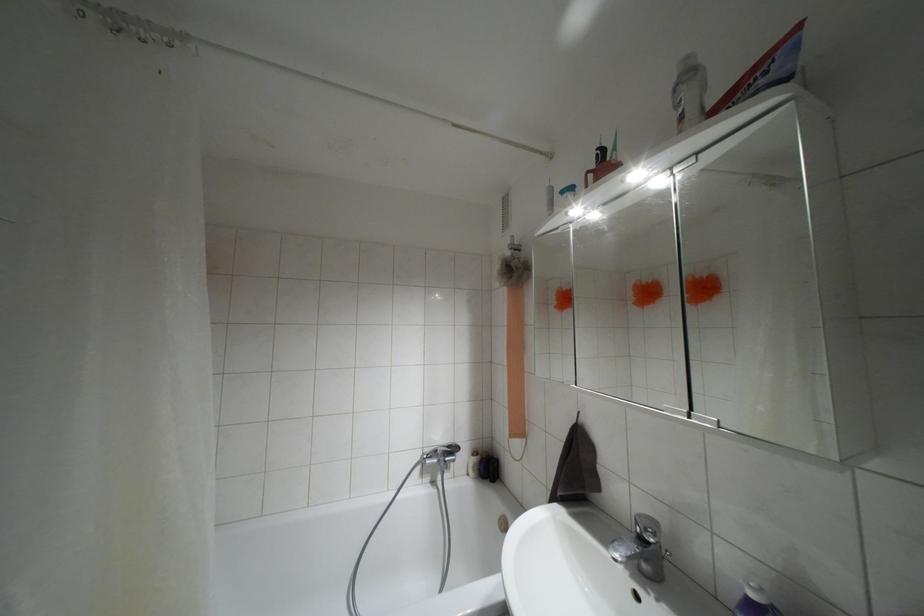
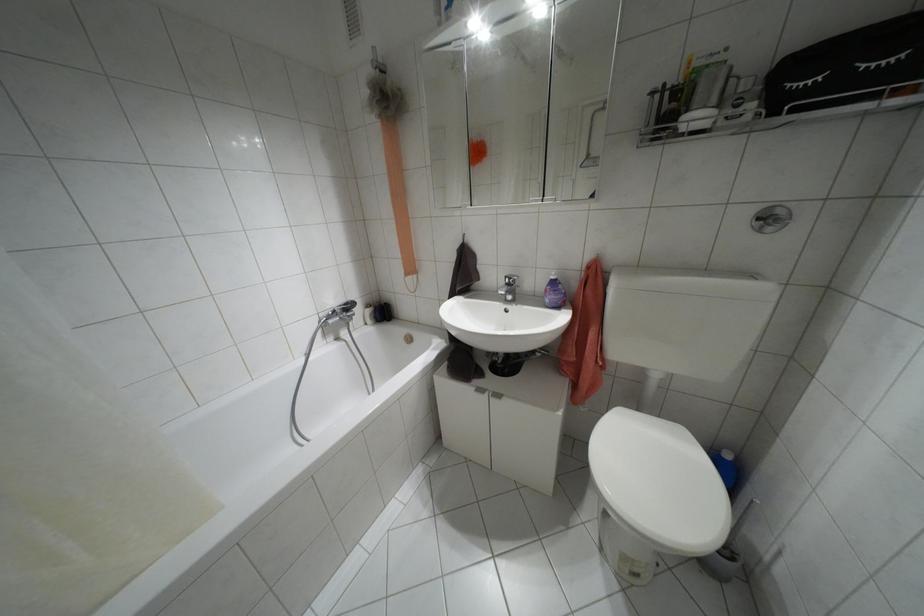
Where in the second image is the point corresponding to the point at 475,452 from the first image?

(367, 305)